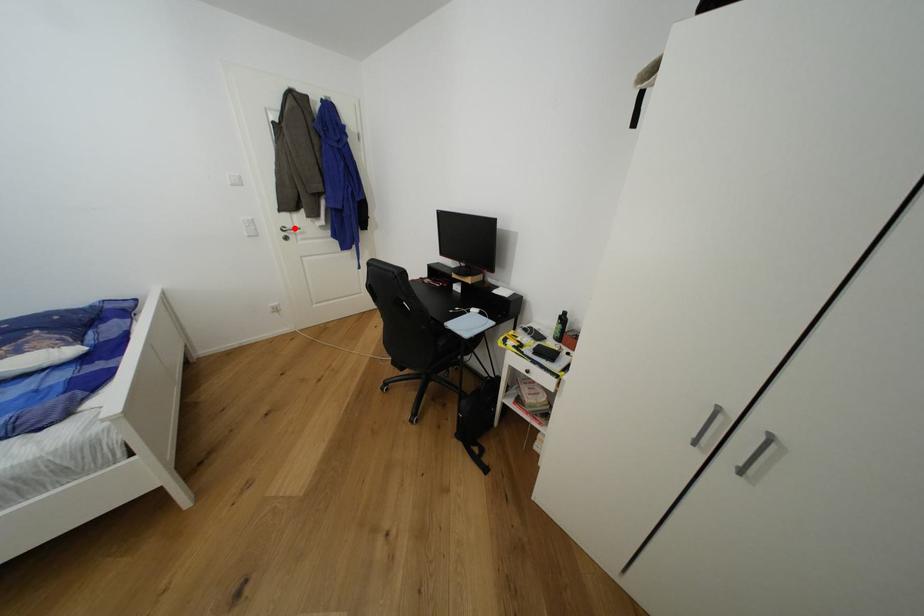
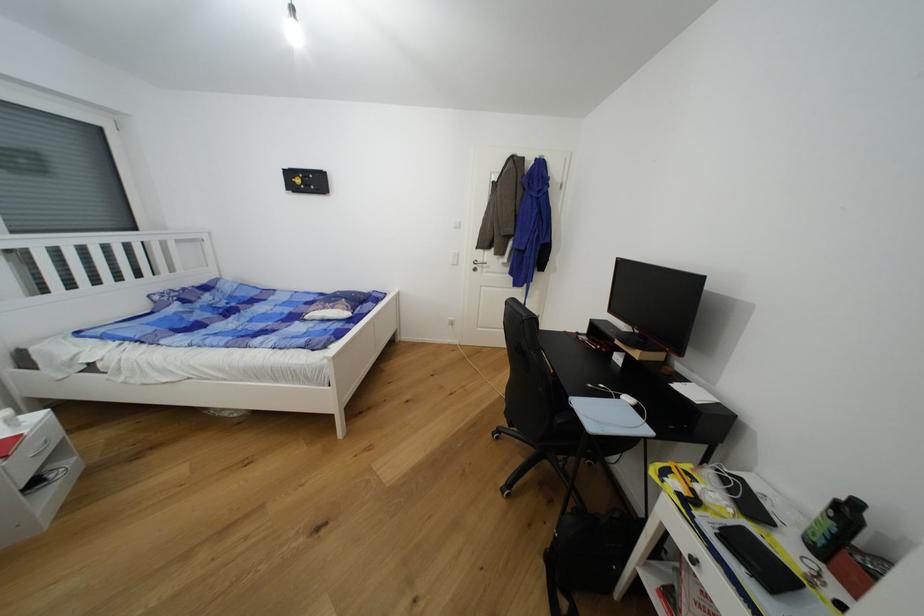
Find the pixel in the second image that matches the highlighted location in the first image.

(484, 262)